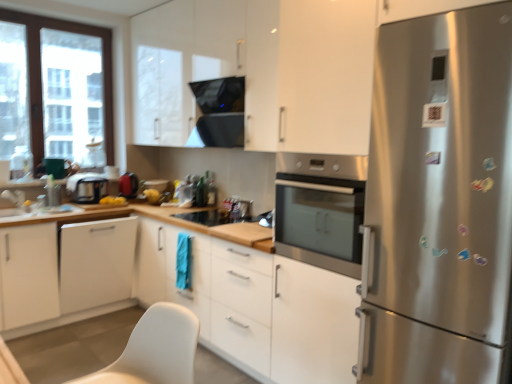
Question: From a real-world perspective, is stainless steel refrigerator at right on top of white glossy cabinet at upper center, which ranks as the 4th cabinetry in bottom-to-top order?

Choices:
 (A) no
 (B) yes

Answer: (A)

Question: Is stainless steel refrigerator at right in front of white glossy cabinet at upper center, which ranks as the 1th cabinetry in top-to-bottom order?

Choices:
 (A) yes
 (B) no

Answer: (A)

Question: Is stainless steel refrigerator at right located outside white glossy cabinet at upper center, which ranks as the 4th cabinetry in bottom-to-top order?

Choices:
 (A) no
 (B) yes

Answer: (B)

Question: From a real-world perspective, is stainless steel refrigerator at right under white glossy cabinet at upper center, which ranks as the 1th cabinetry in top-to-bottom order?

Choices:
 (A) yes
 (B) no

Answer: (A)

Question: Does stainless steel refrigerator at right have a lesser width compared to white glossy cabinet at upper center, which ranks as the 1th cabinetry in top-to-bottom order?

Choices:
 (A) no
 (B) yes

Answer: (A)

Question: Is stainless steel refrigerator at right positioned with its back to white glossy cabinet at upper center, which ranks as the 4th cabinetry in bottom-to-top order?

Choices:
 (A) no
 (B) yes

Answer: (A)

Question: Is white matte cabinet at lower left, acting as the third cabinetry starting from the top, behind white matte cabinet at center, the fourth cabinetry viewed from the top?

Choices:
 (A) no
 (B) yes

Answer: (B)

Question: From the image's perspective, is white matte cabinet at lower left, acting as the third cabinetry starting from the top, located beneath white matte cabinet at center, the fourth cabinetry viewed from the top?

Choices:
 (A) yes
 (B) no

Answer: (B)

Question: Is white matte cabinet at lower left, acting as the third cabinetry starting from the top, oriented away from white matte cabinet at center, the fourth cabinetry viewed from the top?

Choices:
 (A) yes
 (B) no

Answer: (A)

Question: Can you confirm if white matte cabinet at lower left, marked as the 2th cabinetry in a bottom-to-top arrangement, is bigger than white matte cabinet at center, the first cabinetry ordered from the bottom?

Choices:
 (A) no
 (B) yes

Answer: (A)

Question: Considering the relative sizes of white matte cabinet at lower left, acting as the third cabinetry starting from the top, and white matte cabinet at center, the first cabinetry ordered from the bottom, in the image provided, is white matte cabinet at lower left, acting as the third cabinetry starting from the top, smaller than white matte cabinet at center, the first cabinetry ordered from the bottom,?

Choices:
 (A) no
 (B) yes

Answer: (B)

Question: Can you confirm if white matte cabinet at lower left, acting as the third cabinetry starting from the top, is wider than white matte cabinet at center, the first cabinetry ordered from the bottom?

Choices:
 (A) no
 (B) yes

Answer: (A)

Question: Is white glossy cabinet at upper center, which ranks as the 1th cabinetry in top-to-bottom order, turned away from white glossy sink at lower left?

Choices:
 (A) yes
 (B) no

Answer: (B)